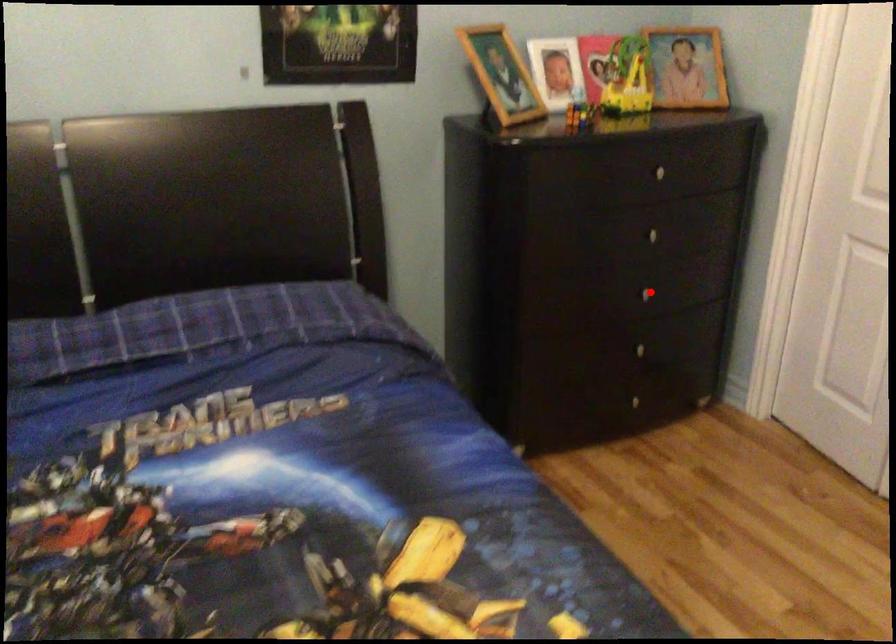
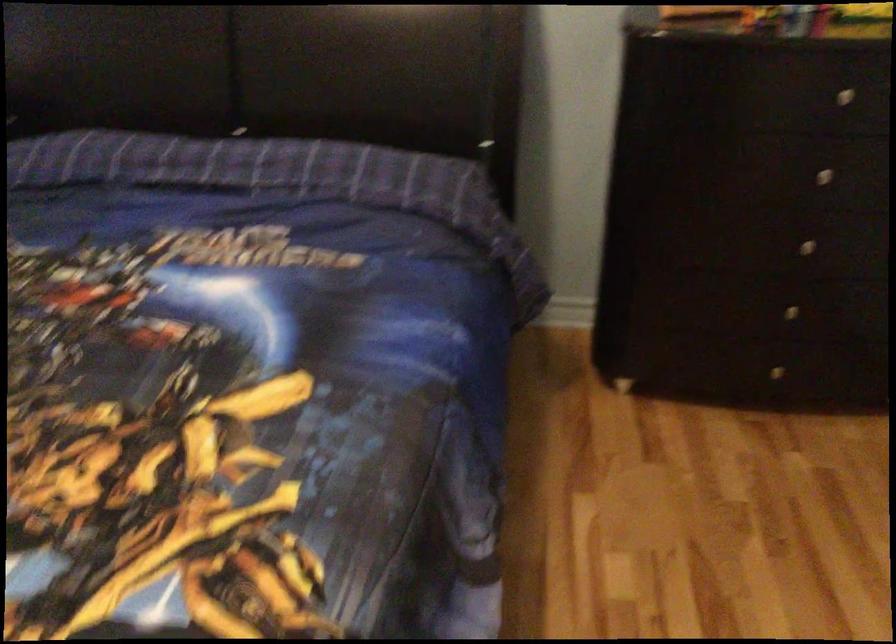
Locate, in the second image, the point that corresponds to the highlighted location in the first image.

(805, 245)